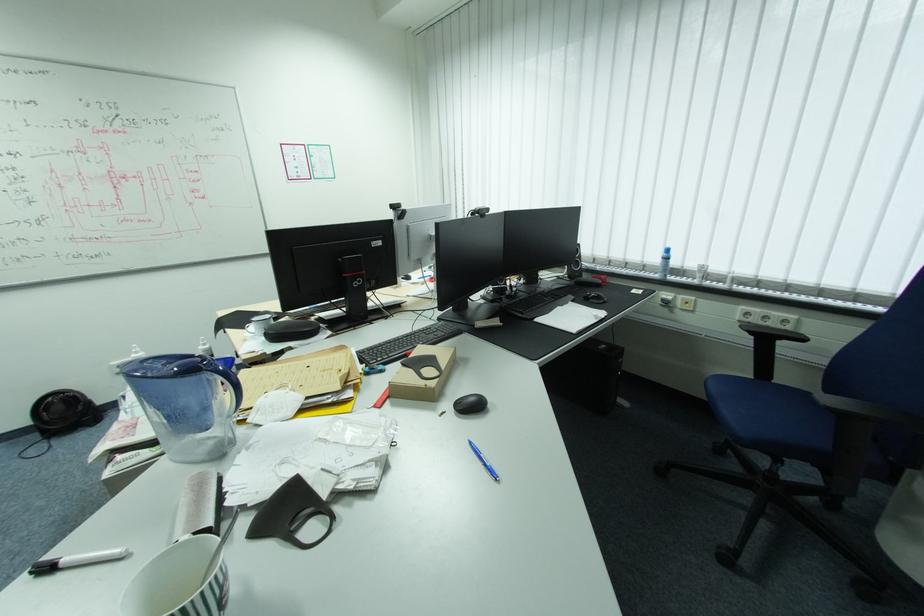
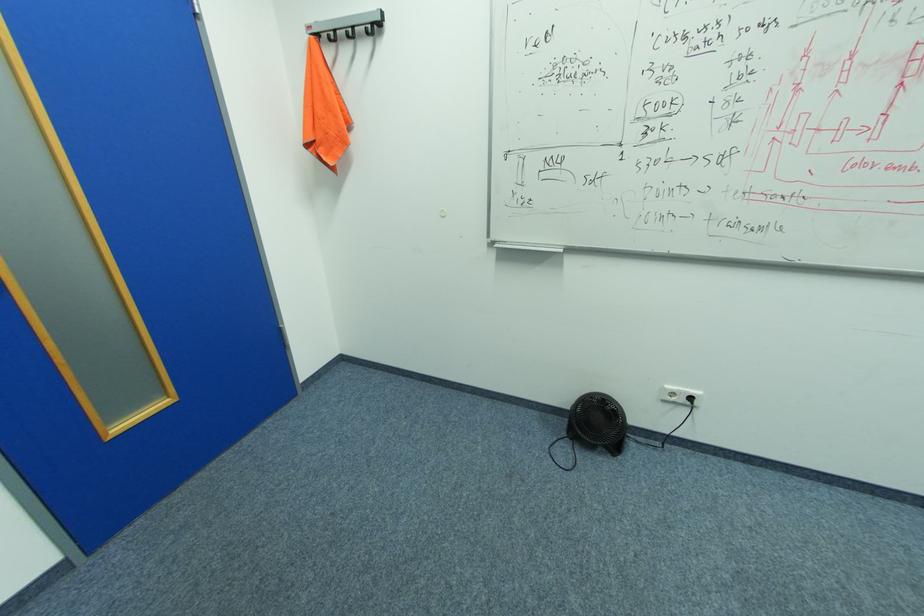
Find the pixel in the second image that matches point 43,435 in the first image.

(568, 423)